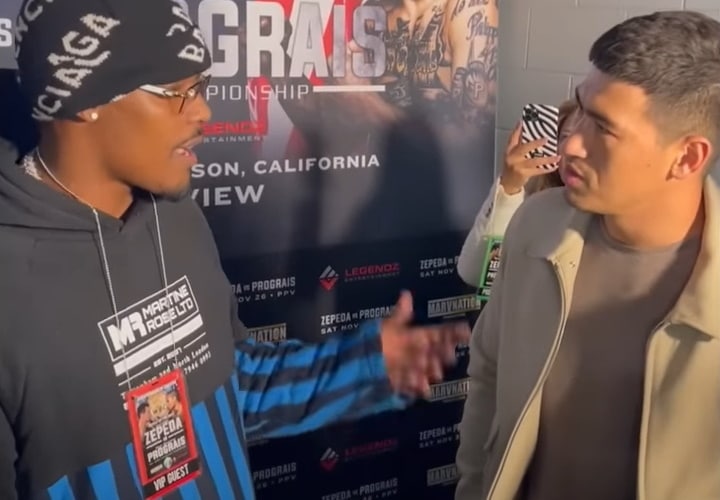
You are a GUI agent. You are given a task and a screenshot of the screen. Output one action in this format:
    pyautogui.click(x=<x>, y=<y>)
    Task: Click on the wall
    
    Given the screenshot: What is the action you would take?
    pyautogui.click(x=522, y=51)